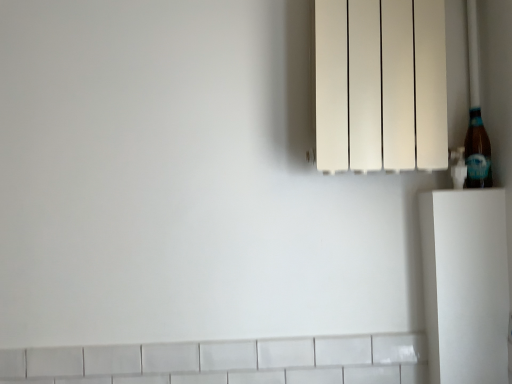
Question: Based on their sizes in the image, would you say brown glass bottle at right is bigger or smaller than white matte radiator at upper right?

Choices:
 (A) small
 (B) big

Answer: (A)

Question: Does point (480, 185) appear closer or farther from the camera than point (399, 148)?

Choices:
 (A) farther
 (B) closer

Answer: (A)

Question: Is brown glass bottle at right wider or thinner than white matte radiator at upper right?

Choices:
 (A) thin
 (B) wide

Answer: (A)

Question: Considering the positions of point (411, 31) and point (476, 119), is point (411, 31) closer or farther from the camera than point (476, 119)?

Choices:
 (A) farther
 (B) closer

Answer: (B)

Question: In the image, is white matte radiator at upper right on the left side or the right side of brown glass bottle at right?

Choices:
 (A) left
 (B) right

Answer: (A)

Question: Looking at the image, does white matte radiator at upper right seem bigger or smaller compared to brown glass bottle at right?

Choices:
 (A) big
 (B) small

Answer: (A)

Question: In terms of height, does white matte radiator at upper right look taller or shorter compared to brown glass bottle at right?

Choices:
 (A) tall
 (B) short

Answer: (A)